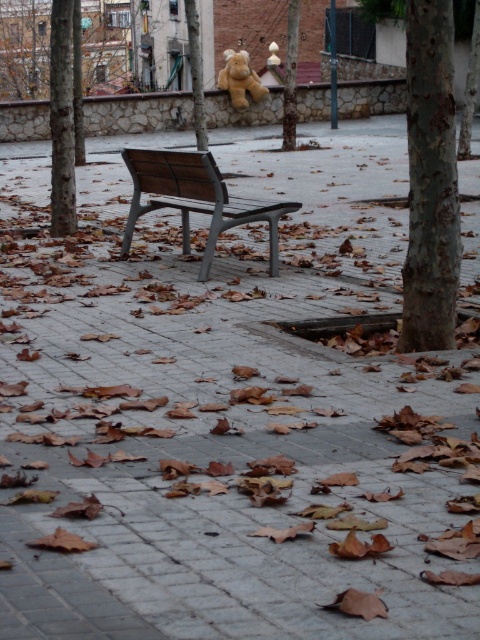
Question: Does smooth brown tree trunk at left appear under soft plush bear at upper center?

Choices:
 (A) yes
 (B) no

Answer: (A)

Question: Estimate the real-world distances between objects in this image. Which object is closer to the wooden bench at center?

Choices:
 (A) smooth brown tree trunk at left
 (B) soft plush bear at upper center
 (C) rough bark tree at right

Answer: (A)

Question: Which point is closer to the camera taking this photo?

Choices:
 (A) 244,88
 (B) 206,211
 (C) 440,128

Answer: (C)

Question: Estimate the real-world distances between objects in this image. Which object is closer to the smooth brown tree trunk at left?

Choices:
 (A) soft plush bear at upper center
 (B) wooden bench at center

Answer: (B)

Question: Can you confirm if rough bark tree at right is smaller than soft plush bear at upper center?

Choices:
 (A) yes
 (B) no

Answer: (A)

Question: In this image, where is rough bark tree at right located relative to soft plush bear at upper center?

Choices:
 (A) left
 (B) right

Answer: (B)